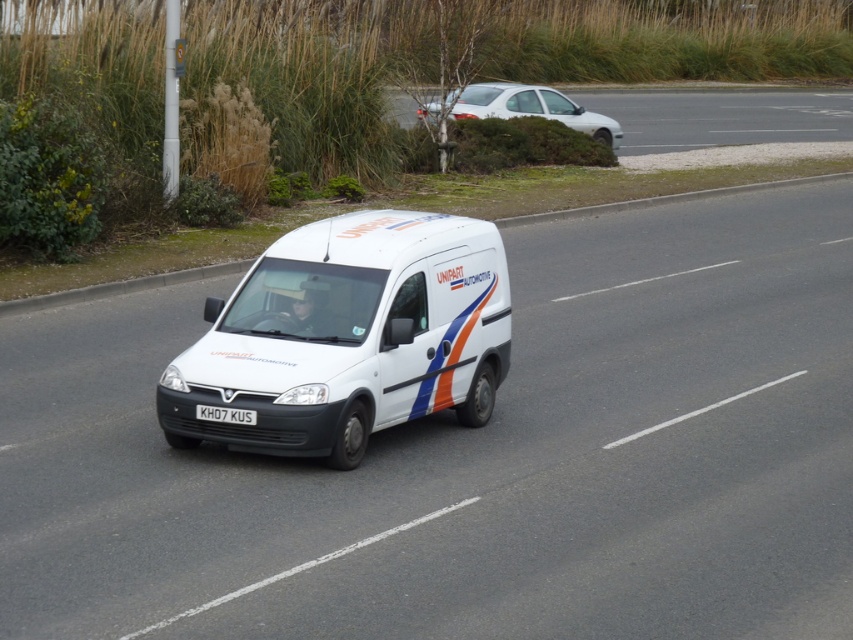
Question: Which of the following is the closest to the observer?

Choices:
 (A) white glossy car at upper center
 (B) white plastic license plate at center
 (C) white matte van at center
 (D) white matte car at upper center

Answer: (C)

Question: Is the position of white matte van at center more distant than that of white glossy car at upper center?

Choices:
 (A) yes
 (B) no

Answer: (B)

Question: Can you confirm if white matte van at center is positioned to the left of white matte car at upper center?

Choices:
 (A) no
 (B) yes

Answer: (B)

Question: Is white glossy car at upper center bigger than white plastic license plate at center?

Choices:
 (A) no
 (B) yes

Answer: (B)

Question: Among these points, which one is nearest to the camera?

Choices:
 (A) (396, 109)
 (B) (585, 129)

Answer: (B)

Question: Which point is farther to the camera?

Choices:
 (A) (239, 420)
 (B) (805, 124)

Answer: (B)